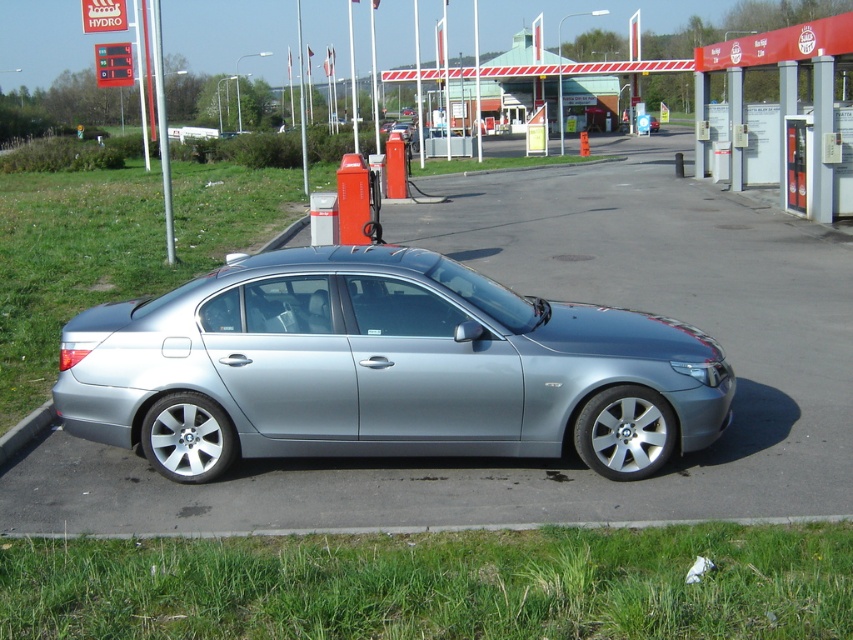
Question: Which object appears farthest from the camera in this image?

Choices:
 (A) satin silver car at center
 (B) silver metallic pole at upper center

Answer: (B)

Question: Does red and white striped barrier gate at center appear under gray concrete curb at lower left?

Choices:
 (A) no
 (B) yes

Answer: (A)

Question: Estimate the real-world distances between objects in this image. Which object is farther from the silver metallic pole at upper center?

Choices:
 (A) gray concrete curb at lower left
 (B) satin silver car at center

Answer: (A)

Question: Is satin silver car at center to the left of red and white striped barrier gate at center from the viewer's perspective?

Choices:
 (A) yes
 (B) no

Answer: (A)

Question: Which of the following is the farthest from the observer?

Choices:
 (A) (323, 332)
 (B) (47, 422)

Answer: (B)

Question: Is satin silver car at center above red and white striped barrier gate at center?

Choices:
 (A) yes
 (B) no

Answer: (B)